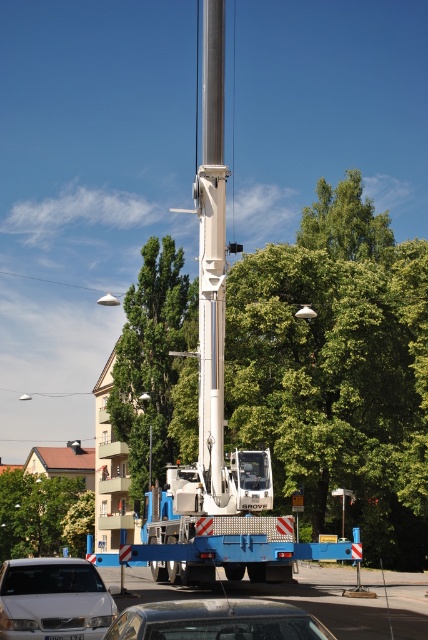
You are standing in front of the crane and trailer on the street. You notice two points marked on the scene. The first point is at coordinate point (204, 435) and the second is at point (210, 620). Which point is closer to you?

Point (204, 435) is further to the camera than point (210, 620), so the point closer to you is point (210, 620).

You are standing in front of the crane on the blue trailer and looking towards the residential buildings. There are two points marked on the scene. Which point, point (x=208, y=269) or point (x=18, y=580), is closer to you?

Point (x=18, y=580) is closer to you because it is nearer than point (x=208, y=269), which is further away from the camera.

You are a delivery driver who needs to pass under the silver metallic pole at center with your truck that is 3.5 meters tall. Can your truck safely pass under the pole without hitting it? Please consider the height of the white matte car at lower left which is 1.8 meters tall.

The silver metallic pole at center has a greater height compared to the white matte car at lower left. Since the white matte car at lower left is 1.8 meters tall and the pole is taller, the truck at 3.5 meters may still pass safely if the pole is higher than 3.5 meters. However, without exact measurements, it is uncertain. The driver should proceed with caution or measure the pole height before driving under it.